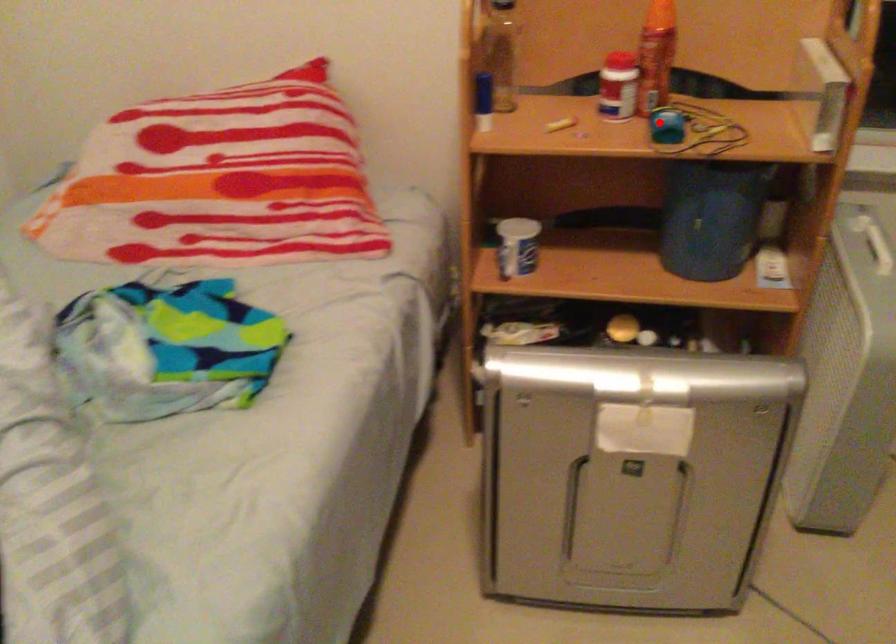
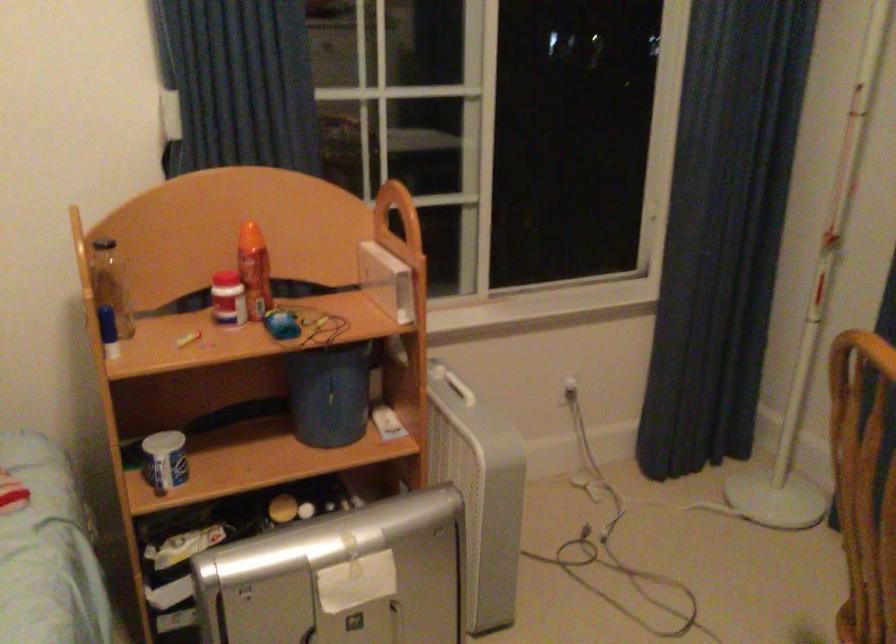
Where in the second image is the point corresponding to the highlighted location from the first image?

(281, 324)